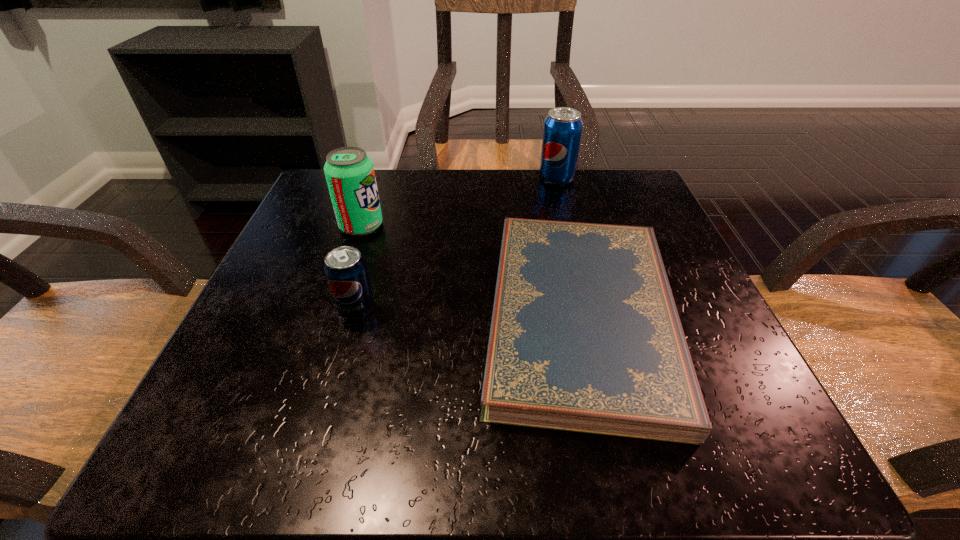
The width and height of the screenshot is (960, 540). I want to click on object that is the second closest one to the farthest soda can, so click(349, 172).

Where is `object that is the second closest to the nearest soda can`? The image size is (960, 540). object that is the second closest to the nearest soda can is located at coordinates (585, 336).

Identify which soda can is located as the nearest to the second farthest soda can. Please provide its 2D coordinates. Your answer should be formatted as a tuple, i.e. [(x, y)], where the tuple contains the x and y coordinates of a point satisfying the conditions above.

[(345, 269)]

Locate which soda can is the closest to the second nearest soda can. Please provide its 2D coordinates. Your answer should be formatted as a tuple, i.e. [(x, y)], where the tuple contains the x and y coordinates of a point satisfying the conditions above.

[(345, 269)]

In order to click on vacant space that satisfies the following two spatial constraints: 1. on the front-facing side of the shortest object; 2. on the left side of the second nearest soda can in this screenshot , I will do `click(330, 316)`.

Locate an element on the screen. The height and width of the screenshot is (540, 960). free location that satisfies the following two spatial constraints: 1. on the front-facing side of the second farthest soda can; 2. on the right side of the paperback book is located at coordinates (330, 316).

Identify the location of free space that satisfies the following two spatial constraints: 1. on the front side of the shortest object; 2. on the left side of the second shortest object. The image size is (960, 540). (354, 316).

Locate an element on the screen. The height and width of the screenshot is (540, 960). free space that satisfies the following two spatial constraints: 1. on the front-facing side of the second farthest soda can; 2. on the back side of the shortest object is located at coordinates (330, 316).

I want to click on vacant area that satisfies the following two spatial constraints: 1. on the back side of the farthest object; 2. on the right side of the paperback book, so click(x=549, y=178).